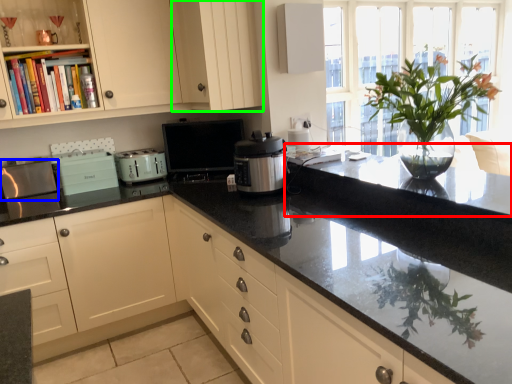
Question: Which object is the closest to the countertop (highlighted by a red box)? Choose among these: appliance (highlighted by a blue box) or cabinetry (highlighted by a green box).

Choices:
 (A) appliance
 (B) cabinetry

Answer: (B)